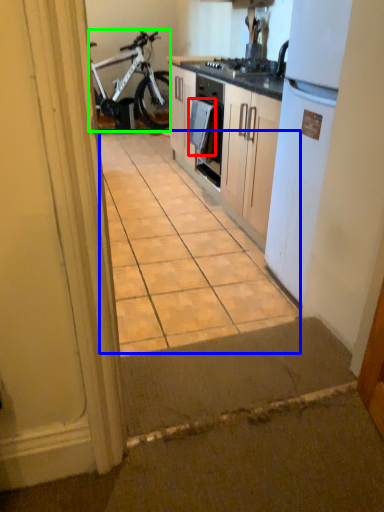
Question: Estimate the real-world distances between objects in this image. Which object is farther from towel/napkin (highlighted by a red box), ceramic tile (highlighted by a blue box) or bicycle (highlighted by a green box)?

Choices:
 (A) ceramic tile
 (B) bicycle

Answer: (B)